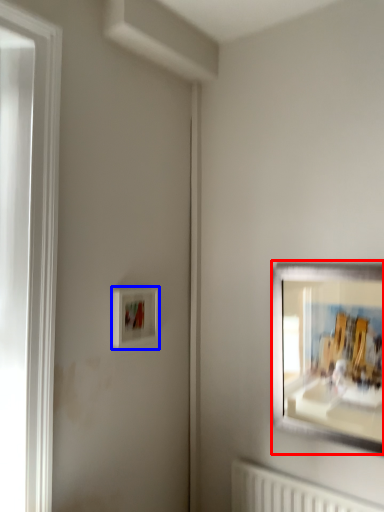
Question: Which object is further to the camera taking this photo, picture frame (highlighted by a red box) or picture frame (highlighted by a blue box)?

Choices:
 (A) picture frame
 (B) picture frame

Answer: (B)